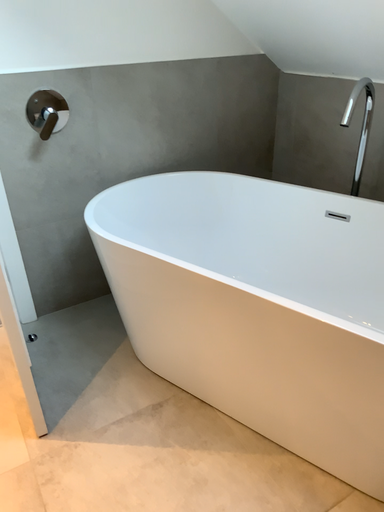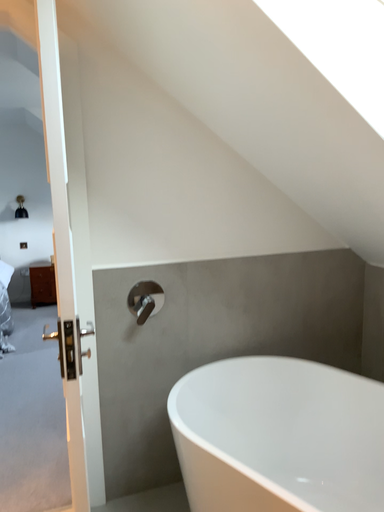
Question: How did the camera likely rotate when shooting the video?

Choices:
 (A) rotated right
 (B) rotated left

Answer: (B)